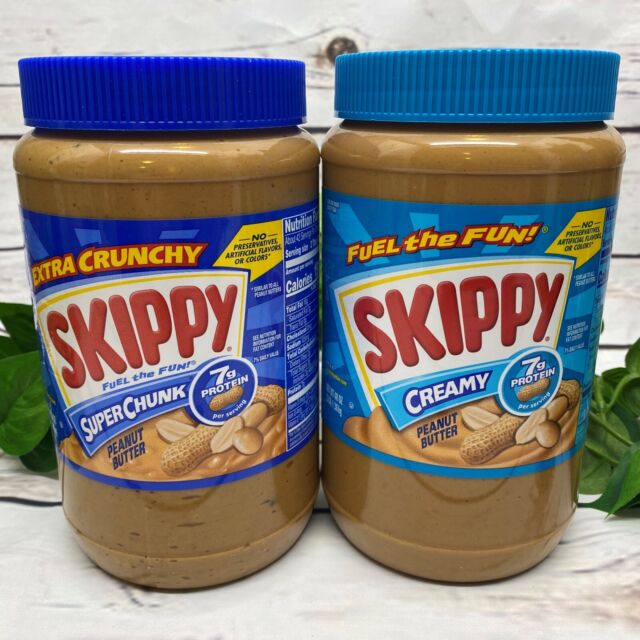
You are a GUI agent. You are given a task and a screenshot of the screen. Output one action in this format:
    pyautogui.click(x=<x>, y=<y>)
    Task: Click on the light gray surface
    
    Given the screenshot: What is the action you would take?
    pyautogui.click(x=310, y=603), pyautogui.click(x=9, y=577)